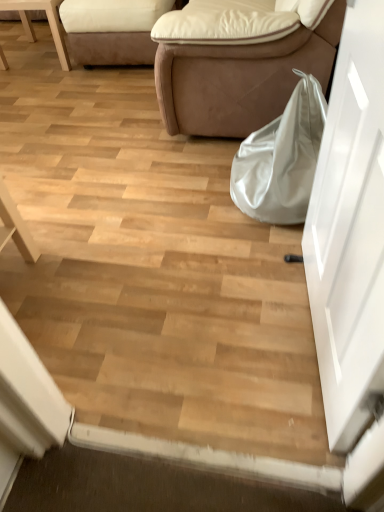
Find the location of a particular element. free space below white glossy door at right (from a real-world perspective) is located at coordinates (307, 339).